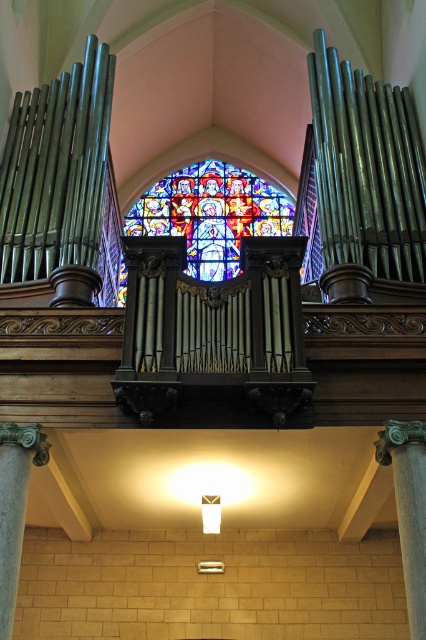
You are standing in the church and want to take a photo of the polished silver organ pipes at left and the gray stone column at lower left. Which object is positioned higher in the frame?

The polished silver organ pipes at left are positioned higher than the gray stone column at lower left.

You are standing in the church and want to locate the polished silver organ pipes at left. According to the coordinates provided, where exactly should you look?

You should look at point 0.298 on the x axis and 0.143 on the y axis to find the polished silver organ pipes at left.